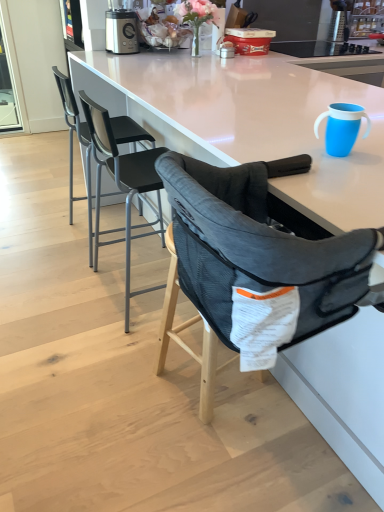
Identify the location of vacant area to the left of black mesh chair at upper left, the 1th chair from the back. (34, 230).